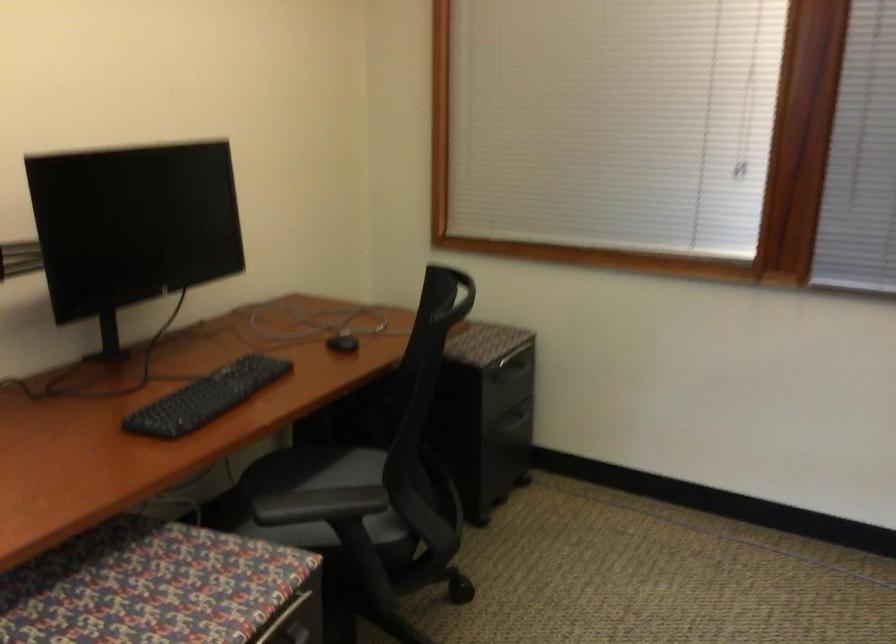
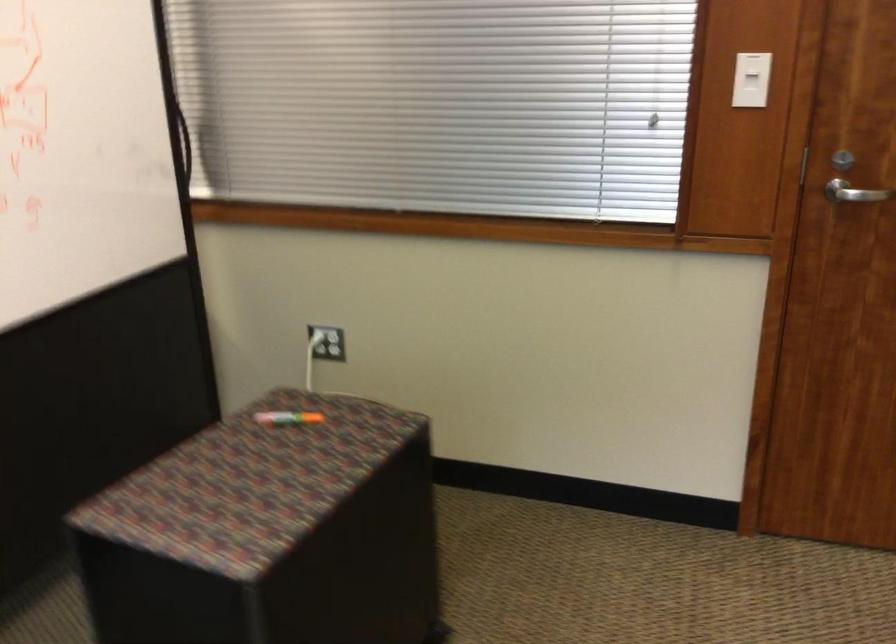
What movement of the cameraman would produce the second image?

The cameraman walked toward right, backward.